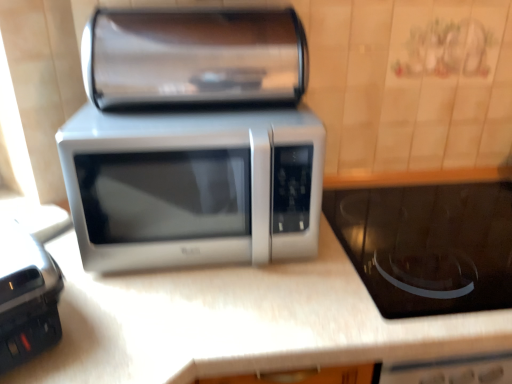
Question: From the image's perspective, would you say white laminate counter at center is shown under satin silver microwave at center?

Choices:
 (A) no
 (B) yes

Answer: (B)

Question: From the image's perspective, does white laminate counter at center appear higher than satin silver microwave at center?

Choices:
 (A) yes
 (B) no

Answer: (B)

Question: Is satin silver microwave at center a part of white laminate counter at center?

Choices:
 (A) yes
 (B) no

Answer: (B)

Question: Is white laminate counter at center positioned before satin silver microwave at center?

Choices:
 (A) no
 (B) yes

Answer: (B)

Question: From a real-world perspective, is white laminate counter at center on top of satin silver microwave at center?

Choices:
 (A) yes
 (B) no

Answer: (B)

Question: Based on their sizes in the image, would you say satin silver microwave at center is bigger or smaller than black glass cooktop at center, marked as the second appliance in a left-to-right arrangement?

Choices:
 (A) small
 (B) big

Answer: (B)

Question: Is satin silver microwave at center wider or thinner than black glass cooktop at center, which is the 1th appliance in right-to-left order?

Choices:
 (A) thin
 (B) wide

Answer: (A)

Question: From their relative heights in the image, would you say satin silver microwave at center is taller or shorter than black glass cooktop at center, marked as the second appliance in a left-to-right arrangement?

Choices:
 (A) tall
 (B) short

Answer: (A)

Question: Considering the relative positions of satin silver microwave at center and black glass cooktop at center, marked as the second appliance in a left-to-right arrangement, in the image provided, is satin silver microwave at center to the left or to the right of black glass cooktop at center, marked as the second appliance in a left-to-right arrangement,?

Choices:
 (A) right
 (B) left

Answer: (B)

Question: Looking at their shapes, would you say satin silver microwave at center is wider or thinner than satin silver microwave at center?

Choices:
 (A) thin
 (B) wide

Answer: (A)

Question: Considering the positions of point (96, 61) and point (74, 220), is point (96, 61) closer or farther from the camera than point (74, 220)?

Choices:
 (A) closer
 (B) farther

Answer: (A)

Question: In terms of size, does satin silver microwave at center appear bigger or smaller than satin silver microwave at center?

Choices:
 (A) big
 (B) small

Answer: (B)

Question: From their relative heights in the image, would you say satin silver microwave at center is taller or shorter than satin silver microwave at center?

Choices:
 (A) short
 (B) tall

Answer: (A)

Question: In the image, is white laminate counter at center positioned in front of or behind satin silver microwave at center?

Choices:
 (A) behind
 (B) front

Answer: (B)

Question: Does point (314, 301) appear closer or farther from the camera than point (137, 72)?

Choices:
 (A) closer
 (B) farther

Answer: (A)